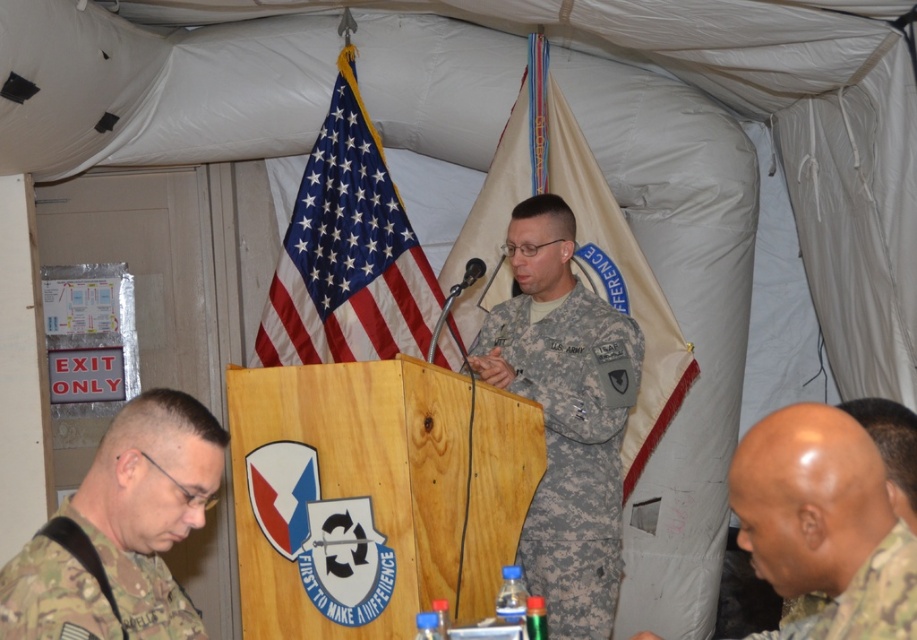
Locate an element on the screen. Image resolution: width=917 pixels, height=640 pixels. blue satin flag at upper center is located at coordinates point(350,257).

Based on the photo, can you confirm if blue satin flag at upper center is smaller than camouflage fabric uniform at lower right?

Incorrect, blue satin flag at upper center is not smaller in size than camouflage fabric uniform at lower right.

Is point (352, 280) behind point (900, 566)?

Yes, it is.

The image size is (917, 640). In order to click on blue satin flag at upper center in this screenshot , I will do `click(350, 257)`.

This screenshot has height=640, width=917. What do you see at coordinates (572, 449) in the screenshot?
I see `camouflage fabric uniform at center` at bounding box center [572, 449].

Is point (549, 385) positioned before point (910, 531)?

That is False.

Find the location of a particular element. camouflage fabric uniform at center is located at coordinates (572, 449).

Between camouflage fabric uniform at center and camouflage uniform at lower right, which one has more height?

camouflage fabric uniform at center is taller.

Does camouflage fabric uniform at center come in front of camouflage uniform at lower right?

No, camouflage fabric uniform at center is behind camouflage uniform at lower right.

Does point (584, 420) lie in front of point (793, 522)?

No.

Locate an element on the screen. The height and width of the screenshot is (640, 917). camouflage fabric uniform at center is located at coordinates coord(572,449).